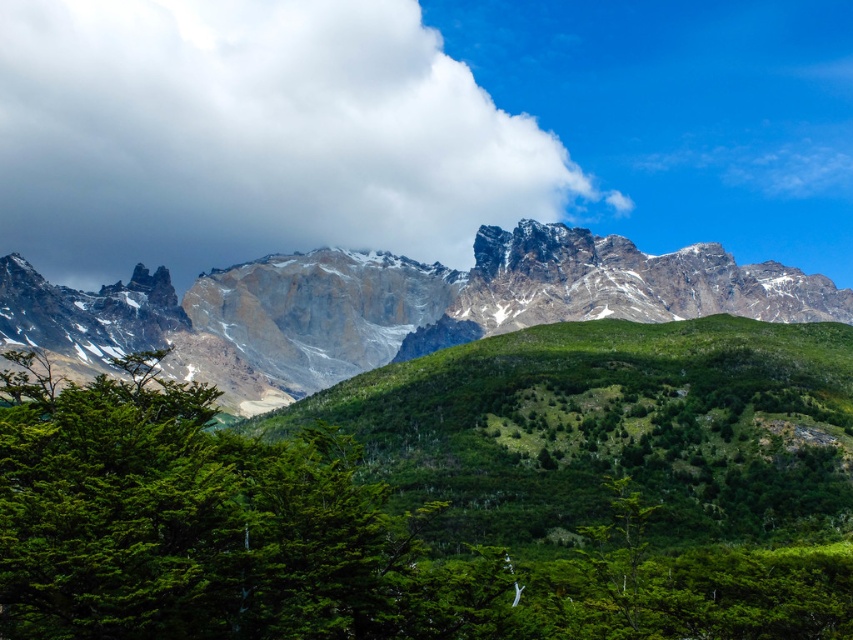
You are standing at the point marked as point (170, 388). If you walk straight ahead for 148.57 meters, will you reach the base of the mountains?

Yes, because the distance between you and the base of the mountains is exactly 148.57 meters, so walking straight ahead for that distance would reach the base.

You are standing at the base of the green leafy tree at center in a mountain landscape. You want to walk to a viewpoint located 150 meters away from you. Can you reach the viewpoint without crossing any rivers or cliffs? The path is clear except for a small stream 100 meters ahead and a steep cliff 120 meters ahead.

The green leafy tree at center is 104.66 meters away from the viewer. Since the viewpoint is 150 meters away, the distance between the tree and the viewpoint is 150m minus 104.66m, which is approximately 45.34 meters. However, there is a stream 100 meters ahead and a cliff 120 meters ahead. The cliff is closer than the viewpoint, so you would encounter the cliff before reaching the viewpoint. Therefore, you cannot reach the viewpoint without crossing the cliff.